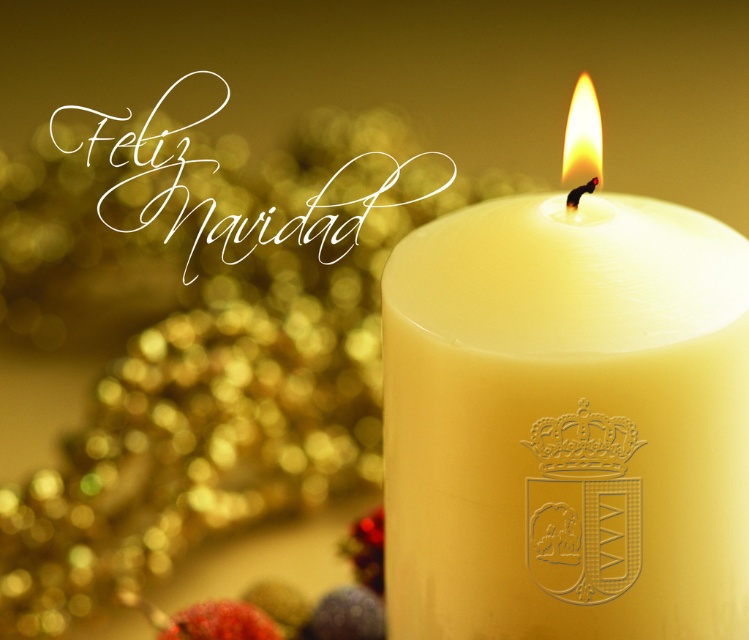
Question: Considering the relative positions of white wax candle at center and white wax candle at upper right in the image provided, where is white wax candle at center located with respect to white wax candle at upper right?

Choices:
 (A) below
 (B) above

Answer: (A)

Question: Which object is closer to the camera taking this photo?

Choices:
 (A) white wax candle at upper right
 (B) white wax candle at center

Answer: (B)

Question: Is white wax candle at center wider than white wax candle at upper right?

Choices:
 (A) no
 (B) yes

Answer: (A)

Question: Is white wax candle at center closer to the viewer compared to white wax candle at upper right?

Choices:
 (A) yes
 (B) no

Answer: (A)

Question: Among these objects, which one is nearest to the camera?

Choices:
 (A) white wax candle at center
 (B) white wax candle at upper right

Answer: (A)